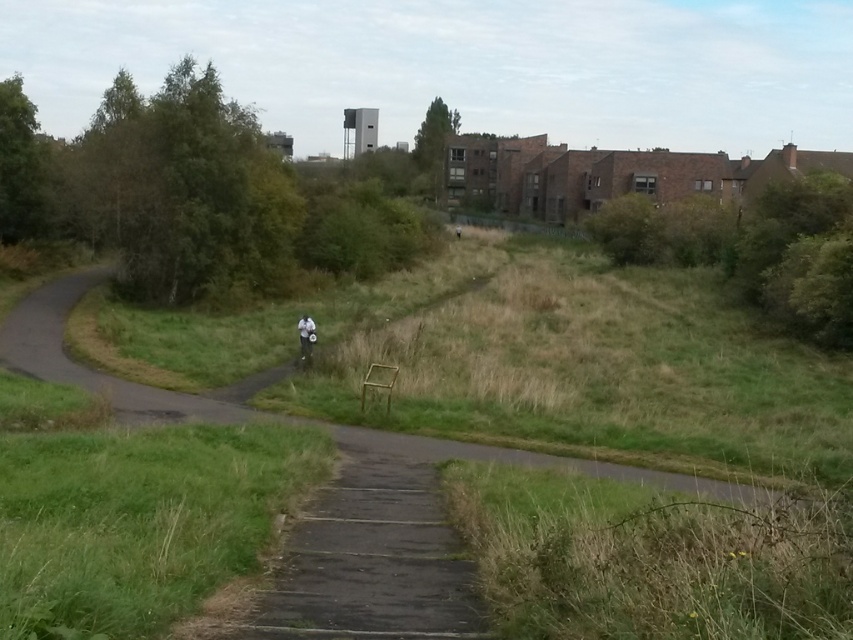
Question: Does green leafy tree at upper left have a greater width compared to green leafy tree at upper center?

Choices:
 (A) yes
 (B) no

Answer: (A)

Question: Which object is closer to the camera taking this photo?

Choices:
 (A) white matte person at center
 (B) green grassy bush at right
 (C) green leafy tree at upper center
 (D) green leafy tree at upper left

Answer: (A)

Question: Does green leafy tree at upper left have a smaller size compared to green grassy bush at right?

Choices:
 (A) yes
 (B) no

Answer: (B)

Question: Among these objects, which one is nearest to the camera?

Choices:
 (A) green leafy tree at upper center
 (B) white matte person at center
 (C) green leafy tree at upper left

Answer: (B)

Question: Which point appears closest to the camera in this image?

Choices:
 (A) (735, 240)
 (B) (96, 244)
 (C) (310, 337)
 (D) (444, 154)

Answer: (C)

Question: Does green leafy tree at upper left have a greater width compared to white matte person at center?

Choices:
 (A) no
 (B) yes

Answer: (B)